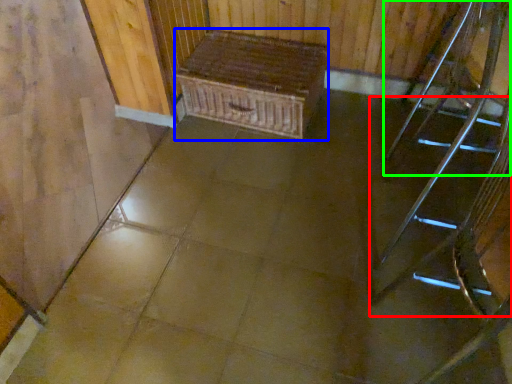
Question: Based on their relative distances, which object is nearer to stairs (highlighted by a red box)? Choose from furniture (highlighted by a blue box) and chair (highlighted by a green box).

Choices:
 (A) furniture
 (B) chair

Answer: (B)